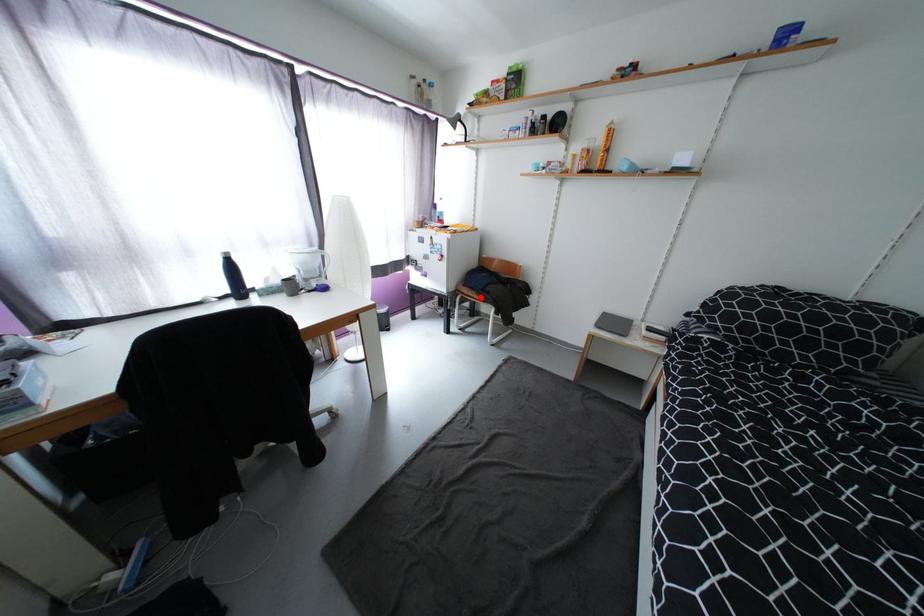
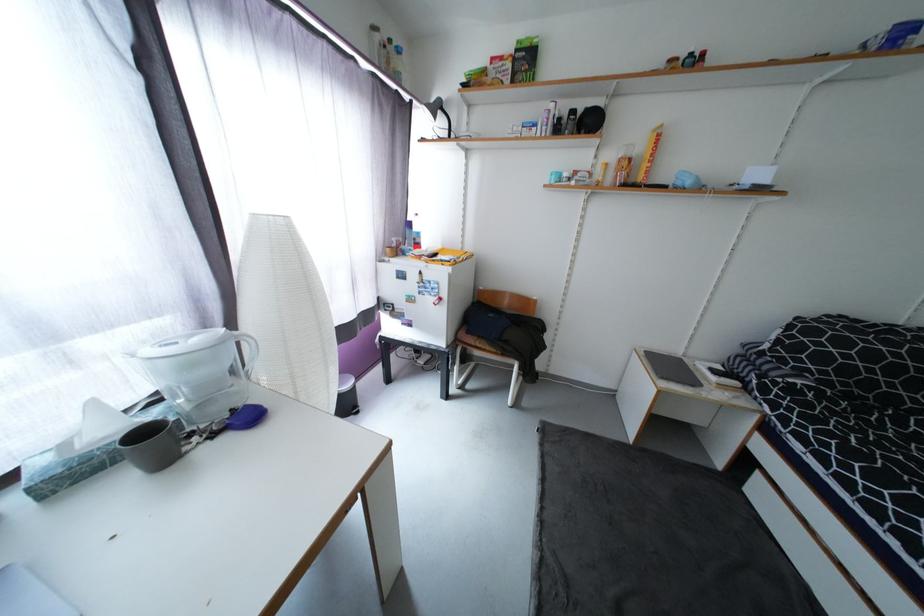
Find the pixel in the second image that matches the highlighted location in the first image.

(493, 349)